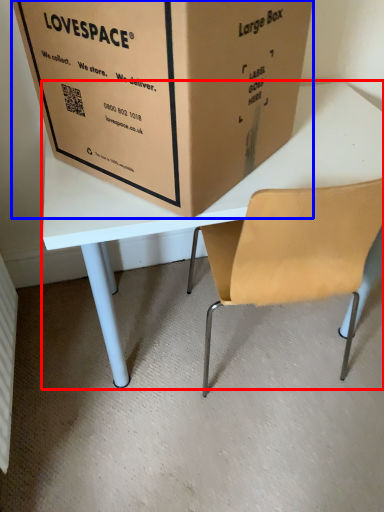
Question: Which object is closer to the camera taking this photo, table (highlighted by a red box) or box (highlighted by a blue box)?

Choices:
 (A) table
 (B) box

Answer: (B)